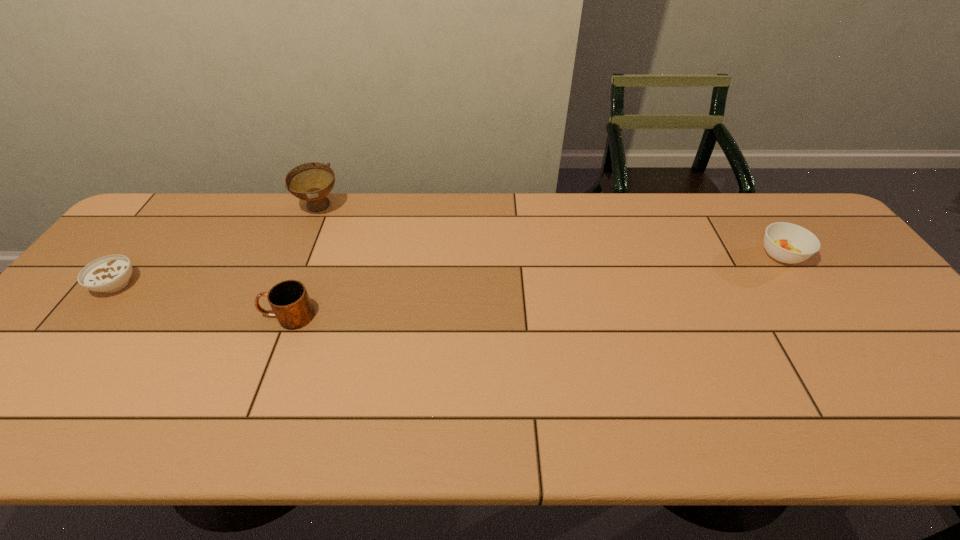
Where is `object that stands as the second closest to the farthest soup bowl`? object that stands as the second closest to the farthest soup bowl is located at coordinates (111, 273).

Locate which object is the closest to the leftmost object. Please provide its 2D coordinates. Your answer should be formatted as a tuple, i.e. [(x, y)], where the tuple contains the x and y coordinates of a point satisfying the conditions above.

[(289, 300)]

At what (x,y) coordinates should I click in order to perform the action: click on soup bowl object that ranks as the second closest to the shortest soup bowl. Please return your answer as a coordinate pair (x, y). Image resolution: width=960 pixels, height=540 pixels. Looking at the image, I should click on (785, 242).

You are a GUI agent. You are given a task and a screenshot of the screen. Output one action in this format:
    pyautogui.click(x=<x>, y=<y>)
    Task: Click on the soup bowl that stands as the third closest to the third shortest object
    This screenshot has width=960, height=540.
    Given the screenshot: What is the action you would take?
    pyautogui.click(x=785, y=242)

Image resolution: width=960 pixels, height=540 pixels. Find the location of `vacant area that satisfies the following two spatial constraints: 1. on the back side of the second tallest soup bowl; 2. on the left side of the shortest soup bowl`. vacant area that satisfies the following two spatial constraints: 1. on the back side of the second tallest soup bowl; 2. on the left side of the shortest soup bowl is located at coordinates (139, 255).

The height and width of the screenshot is (540, 960). What are the coordinates of `vacant space that satisfies the following two spatial constraints: 1. on the front side of the third tallest object; 2. on the left side of the tallest soup bowl` in the screenshot? It's located at coord(300,255).